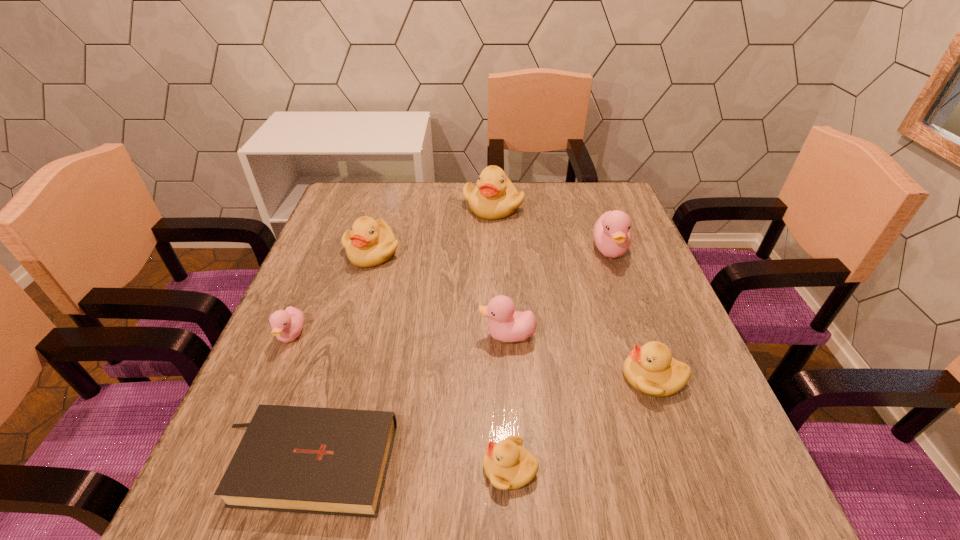
The image size is (960, 540). I want to click on object that is the seventh closest one to the farthest yellow duckling, so click(x=508, y=465).

Locate an element on the screen. This screenshot has width=960, height=540. the fourth closest object relative to the second biggest pink duckling is located at coordinates (612, 235).

Find the location of a particular element. duckling object that ranks as the fifth closest to the shortest object is located at coordinates (651, 369).

Point out which duckling is positioned as the fourth nearest to the second pink duckling from left to right. Please provide its 2D coordinates. Your answer should be formatted as a tuple, i.e. [(x, y)], where the tuple contains the x and y coordinates of a point satisfying the conditions above.

[(369, 243)]

Select which yellow duckling is the closest to the biggest pink duckling. Please provide its 2D coordinates. Your answer should be formatted as a tuple, i.e. [(x, y)], where the tuple contains the x and y coordinates of a point satisfying the conditions above.

[(495, 197)]

I want to click on yellow duckling that is the closest to the smallest yellow duckling, so click(x=651, y=369).

Where is `pink duckling object that ranks as the second closest to the shortest object`? The height and width of the screenshot is (540, 960). pink duckling object that ranks as the second closest to the shortest object is located at coordinates (507, 325).

Find the location of a particular element. The width and height of the screenshot is (960, 540). pink duckling that stands as the closest to the farthest pink duckling is located at coordinates (507, 325).

Identify the location of free space that satisfies the following two spatial constraints: 1. on the front-facing side of the farthest pink duckling; 2. on the front-facing side of the second pink duckling from left to right. (641, 335).

Locate an element on the screen. This screenshot has width=960, height=540. vacant point that satisfies the following two spatial constraints: 1. on the front-facing side of the farthest pink duckling; 2. at the face of the third nearest object is located at coordinates (656, 377).